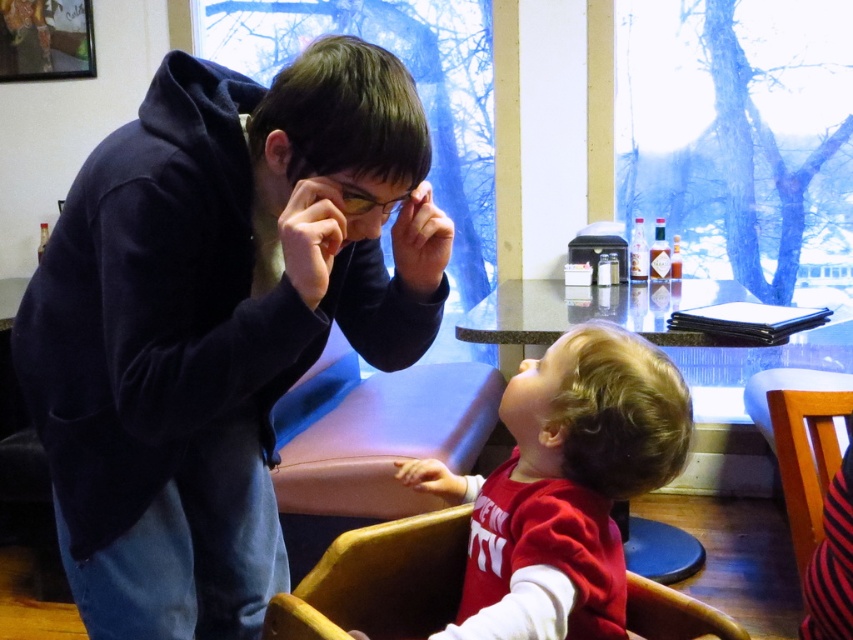
Question: Is matte red shirt at lower center further to the viewer compared to wooden chair at lower right?

Choices:
 (A) yes
 (B) no

Answer: (B)

Question: Which object is the farthest from the dark blue hoodie at upper left?

Choices:
 (A) wooden chair at lower center
 (B) matte red shirt at lower center

Answer: (A)

Question: Which object is positioned closest to the wooden chair at lower center?

Choices:
 (A) matte red shirt at lower center
 (B) wooden chair at lower right

Answer: (A)

Question: Which point is farther to the camera?

Choices:
 (A) [788, 488]
 (B) [590, 410]

Answer: (A)

Question: Can you confirm if dark blue hoodie at upper left is positioned below wooden chair at lower center?

Choices:
 (A) no
 (B) yes

Answer: (A)

Question: Is matte red shirt at lower center bigger than wooden chair at lower right?

Choices:
 (A) no
 (B) yes

Answer: (B)